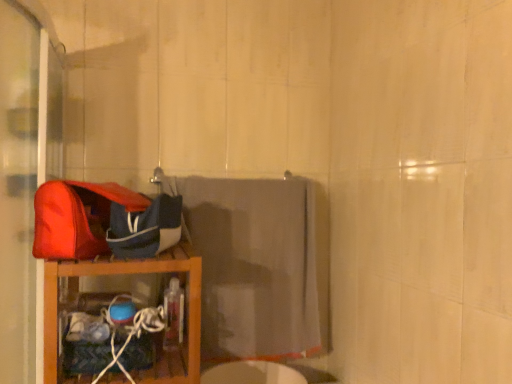
Question: Is blue fabric bag at left located within matte red shoulder bag at left?

Choices:
 (A) no
 (B) yes

Answer: (B)

Question: Is matte red shoulder bag at left closer to the viewer compared to blue fabric bag at left?

Choices:
 (A) no
 (B) yes

Answer: (B)

Question: Considering the relative sizes of matte red shoulder bag at left and blue fabric bag at left in the image provided, is matte red shoulder bag at left bigger than blue fabric bag at left?

Choices:
 (A) no
 (B) yes

Answer: (A)

Question: Does matte red shoulder bag at left appear on the right side of blue fabric bag at left?

Choices:
 (A) yes
 (B) no

Answer: (B)

Question: From a real-world perspective, is matte red shoulder bag at left physically above blue fabric bag at left?

Choices:
 (A) no
 (B) yes

Answer: (B)

Question: Is point (106, 223) positioned closer to the camera than point (309, 299)?

Choices:
 (A) closer
 (B) farther

Answer: (A)

Question: Considering the positions of matte red shoulder bag at left and gray fabric towel at center in the image, is matte red shoulder bag at left wider or thinner than gray fabric towel at center?

Choices:
 (A) wide
 (B) thin

Answer: (A)

Question: From a real-world perspective, is matte red shoulder bag at left positioned above or below gray fabric towel at center?

Choices:
 (A) above
 (B) below

Answer: (A)

Question: Choose the correct answer: Is matte red shoulder bag at left inside gray fabric towel at center or outside it?

Choices:
 (A) inside
 (B) outside

Answer: (B)

Question: Is wooden shelf at left in front of or behind matte red shoulder bag at left in the image?

Choices:
 (A) behind
 (B) front

Answer: (A)

Question: From the image's perspective, is wooden shelf at left positioned above or below matte red shoulder bag at left?

Choices:
 (A) above
 (B) below

Answer: (B)

Question: Is point (176, 261) positioned closer to the camera than point (69, 211)?

Choices:
 (A) closer
 (B) farther

Answer: (B)

Question: Visually, is wooden shelf at left positioned to the left or to the right of matte red shoulder bag at left?

Choices:
 (A) right
 (B) left

Answer: (A)

Question: Is matte red shoulder bag at left in front of or behind wooden shelf at left in the image?

Choices:
 (A) behind
 (B) front

Answer: (B)

Question: Is point (41, 253) closer or farther from the camera than point (167, 379)?

Choices:
 (A) closer
 (B) farther

Answer: (A)